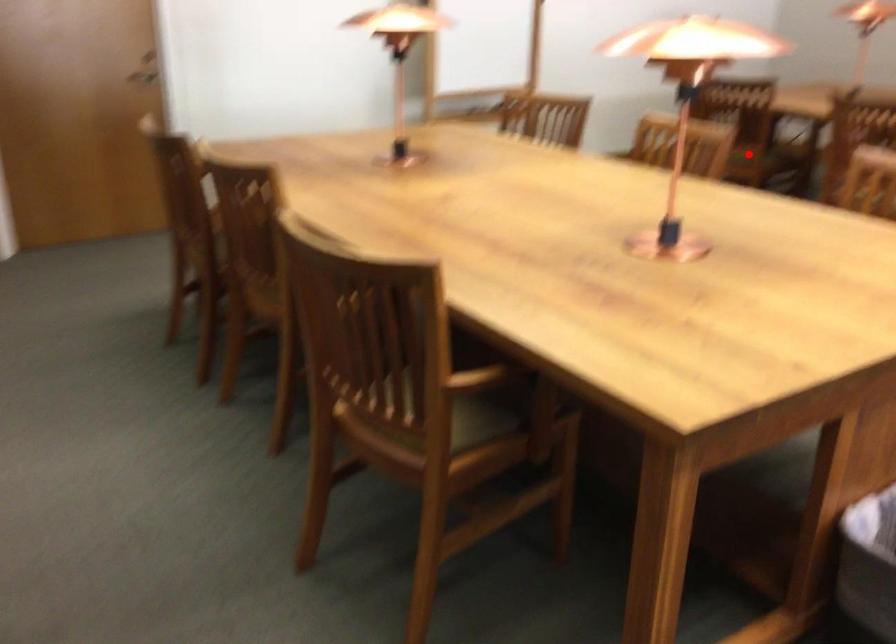
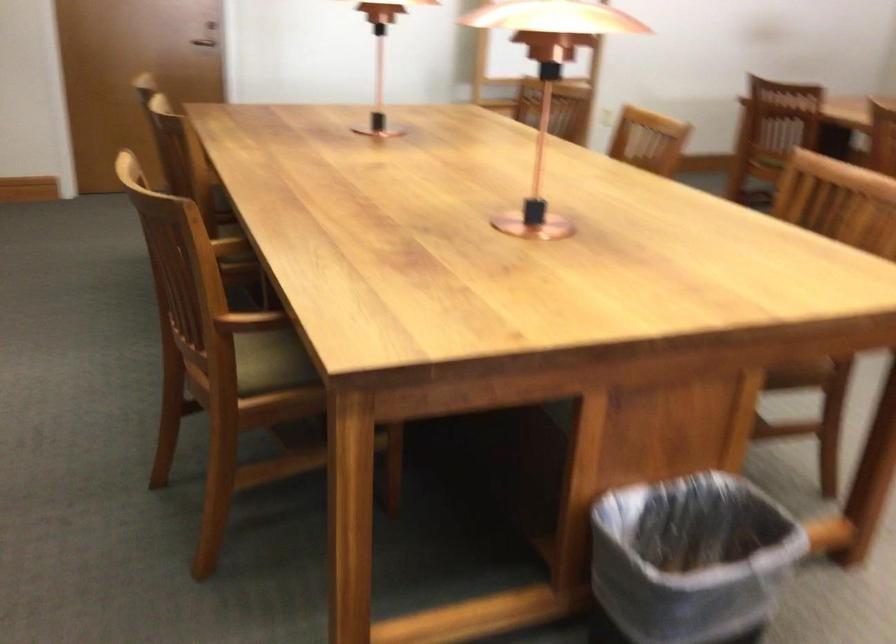
Where in the second image is the point corresponding to the highlighted location from the first image?

(767, 162)